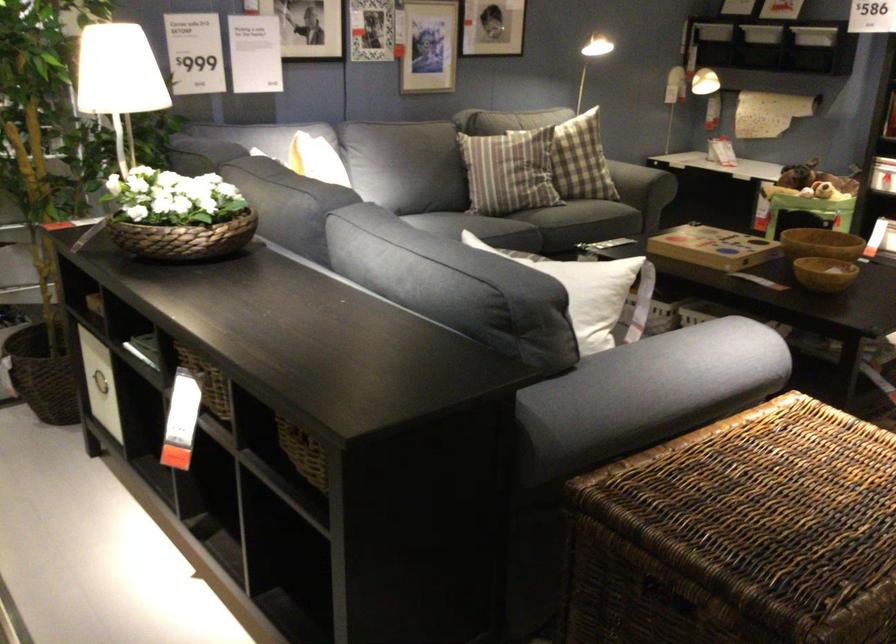
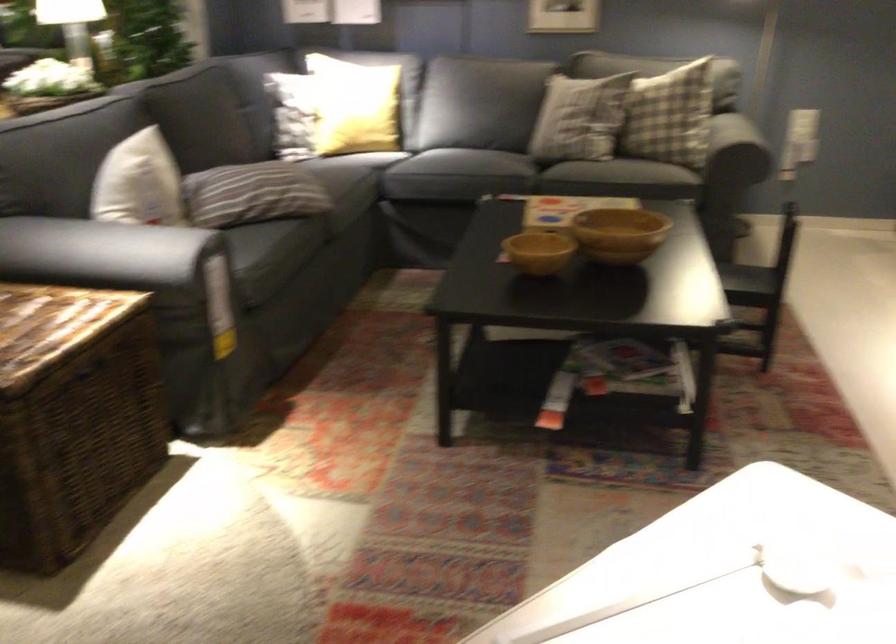
Question: I am providing you with two images of the same scene from different viewpoints. Which of the following objects are not visible in image2?

Choices:
 (A) dark sofa sitting surface
 (B) digital display clock
 (C) large wooden bowl
 (D) sofa sitting surface

Answer: (D)